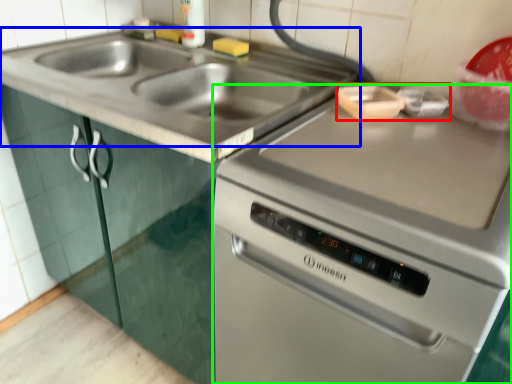
Question: Based on their relative distances, which object is farther from appliance (highlighted by a red box)? Choose from sink (highlighted by a blue box) and oven (highlighted by a green box).

Choices:
 (A) sink
 (B) oven

Answer: (A)